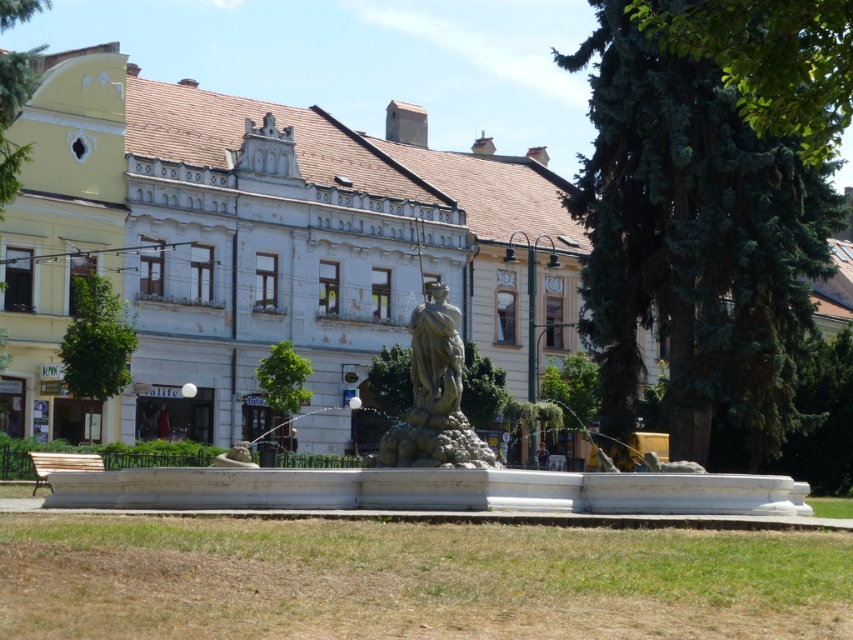
Question: Among these points, which one is nearest to the camera?

Choices:
 (A) [734, 26]
 (B) [453, 356]

Answer: (A)

Question: Does green textured tree at center right have a smaller size compared to green leafy tree at upper right?

Choices:
 (A) yes
 (B) no

Answer: (B)

Question: In this image, where is green leafy tree at upper right located relative to green leafy tree at upper left?

Choices:
 (A) right
 (B) left

Answer: (A)

Question: Which point appears closest to the camera in this image?

Choices:
 (A) (602, 176)
 (B) (833, 76)
 (C) (527, 490)

Answer: (B)

Question: Which object is closer to the camera taking this photo?

Choices:
 (A) white marble fountain at center
 (B) green leafy tree at upper right
 (C) green leafy tree at upper left

Answer: (B)

Question: Can you confirm if green leafy tree at upper right is positioned above bronze statue at center?

Choices:
 (A) yes
 (B) no

Answer: (A)